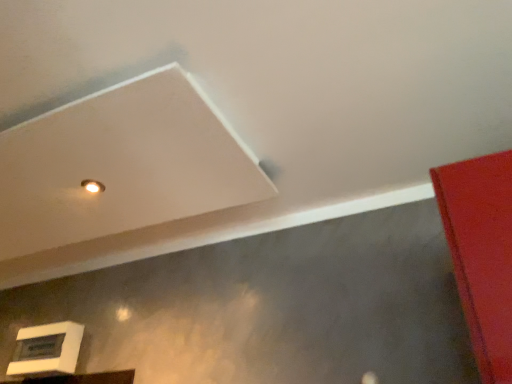
Describe the element at coordinates (121, 165) in the screenshot. I see `matte white exhaust hood at upper left` at that location.

The width and height of the screenshot is (512, 384). I want to click on matte white exhaust hood at upper left, so pyautogui.click(x=121, y=165).

Identify the location of matte white exhaust hood at upper left. This screenshot has width=512, height=384. (121, 165).